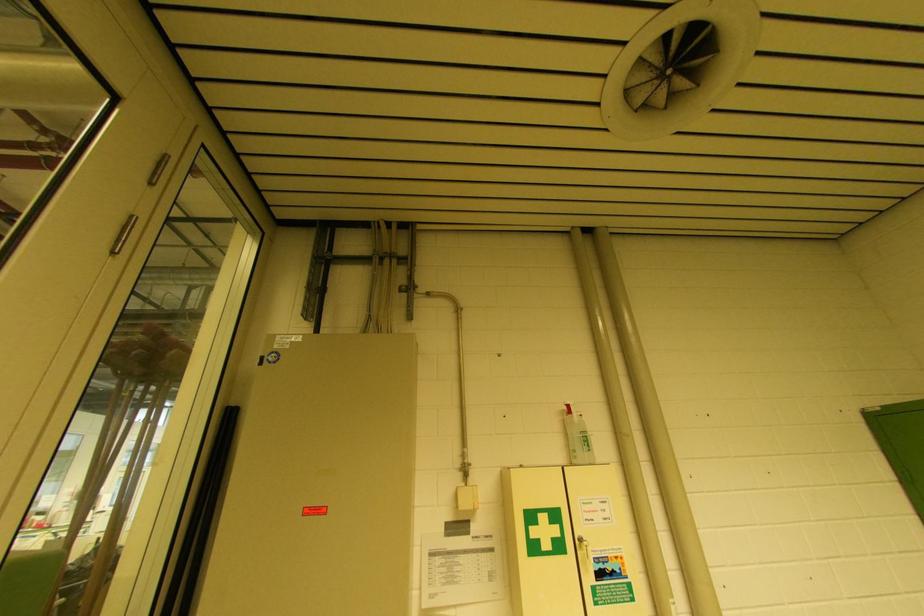
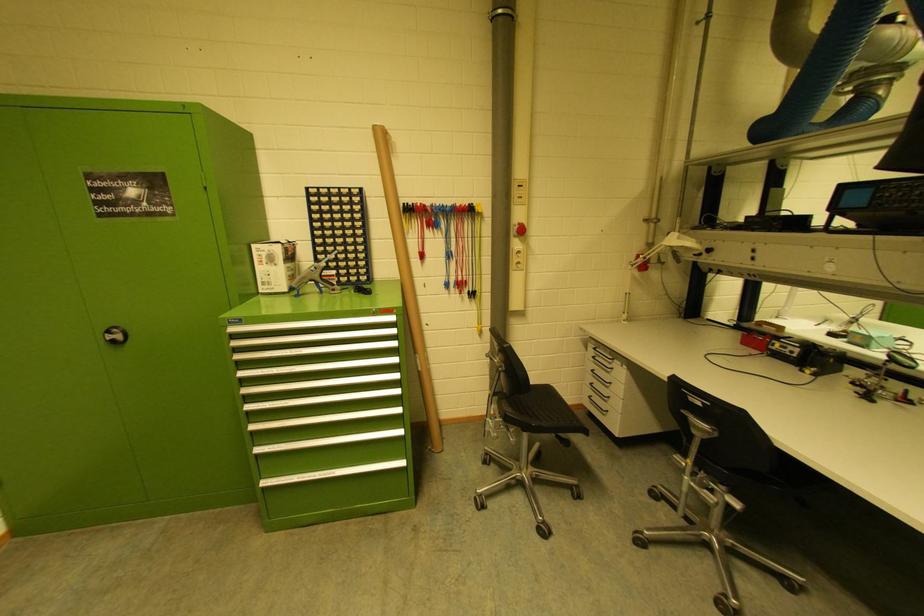
Question: The images are taken continuously from a first-person perspective. In which direction is your viewpoint rotating?

Choices:
 (A) Left
 (B) Right
 (C) Up
 (D) Down

Answer: (B)